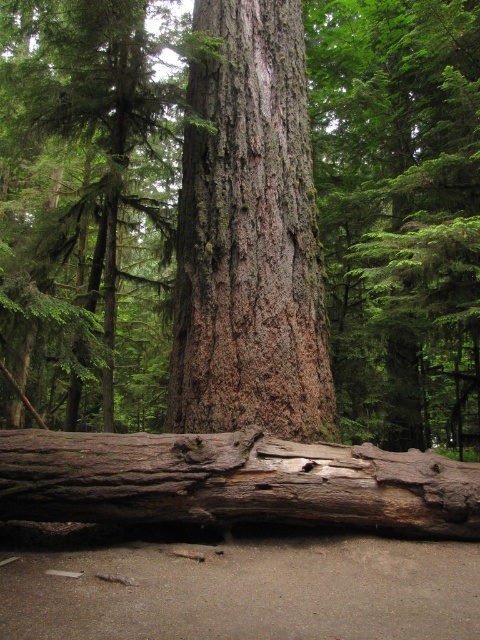
Question: Considering the real-world distances, which object is closest to the rough bark log at lower center?

Choices:
 (A) rough bark tree trunk at center
 (B) smooth brown bark at center

Answer: (A)

Question: Which point appears farthest from the camera in this image?

Choices:
 (A) (380, 262)
 (B) (352, 477)

Answer: (A)

Question: Does smooth brown bark at center have a greater width compared to rough bark tree trunk at center?

Choices:
 (A) yes
 (B) no

Answer: (A)

Question: Is smooth brown bark at center above rough bark tree trunk at center?

Choices:
 (A) yes
 (B) no

Answer: (B)

Question: Can you confirm if smooth brown bark at center is bigger than rough bark log at lower center?

Choices:
 (A) yes
 (B) no

Answer: (A)

Question: Which of the following is the farthest from the observer?

Choices:
 (A) (26, 52)
 (B) (242, 163)
 (C) (274, 438)

Answer: (A)